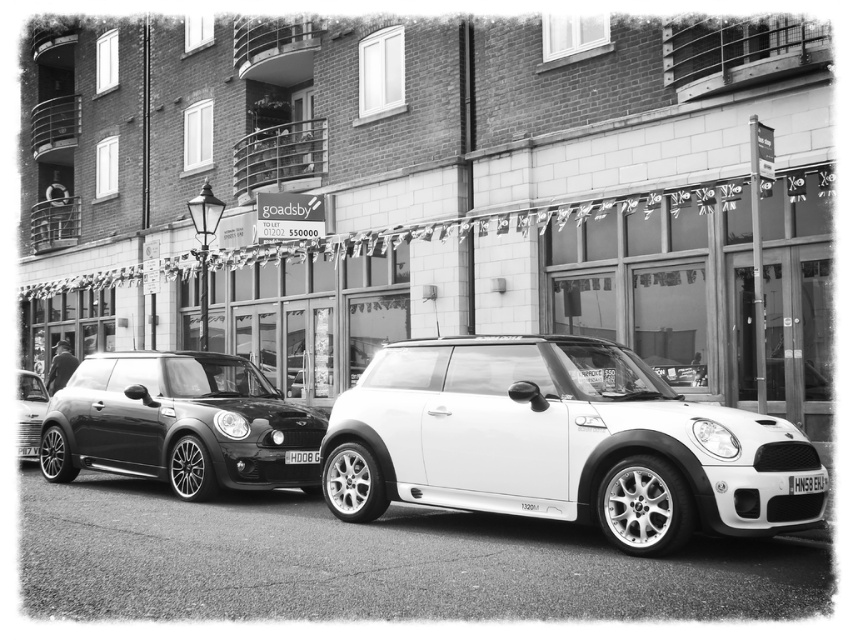
Question: Does shiny black car at left have a lesser width compared to shiny silver car at left?

Choices:
 (A) yes
 (B) no

Answer: (B)

Question: Is white metallic car at center to the right of shiny black car at left from the viewer's perspective?

Choices:
 (A) no
 (B) yes

Answer: (B)

Question: Which object is the farthest from the shiny black car at left?

Choices:
 (A) black plastic license plate at center
 (B) shiny silver car at left
 (C) white metallic car at center

Answer: (C)

Question: Which of the following is the farthest from the observer?

Choices:
 (A) black plastic license plate at center
 (B) white plastic license plate at center
 (C) white metallic car at center

Answer: (A)

Question: Can you confirm if shiny black car at left is smaller than black plastic license plate at center?

Choices:
 (A) yes
 (B) no

Answer: (B)

Question: Which of these objects is positioned farthest from the shiny black car at left?

Choices:
 (A) black plastic license plate at center
 (B) shiny silver car at left
 (C) white plastic license plate at center
 (D) white metallic car at center

Answer: (C)